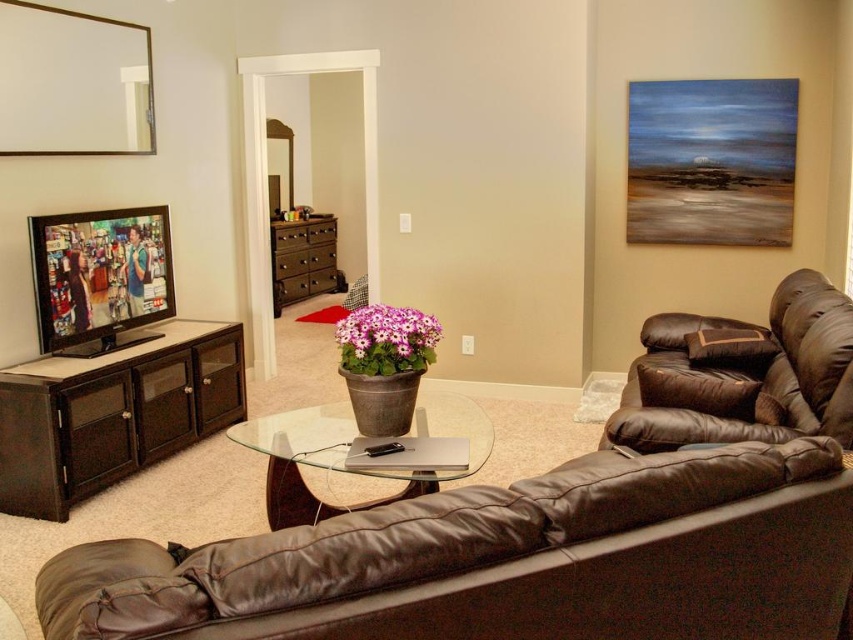
You are standing in the living room and want to place a new 1.5m wide sofa. The sofa requires a wall space of 1.6m to fit. Based on the scene, can you determine if there is enough space on the wall where the dark brown wood entertainment center at left is located?

The dark brown wood entertainment center at left is located at point (113, 413). Since the sofa requires 1.6m of wall space and the entertainment center is positioned at that coordinate, there is insufficient information to determine the available wall space. Please check the actual dimensions of the wall and the entertainment center to confirm if there is enough space.

You are a guest entering the living room and want to sit down. The host offers you a seat either on the brown leather couch at left or the brown leather armchair at right. Considering your height, which seat would be more comfortable for you?

The brown leather couch at left has a greater height compared to the brown leather armchair at right, so it would be more comfortable for someone of average height as it provides better support and posture.